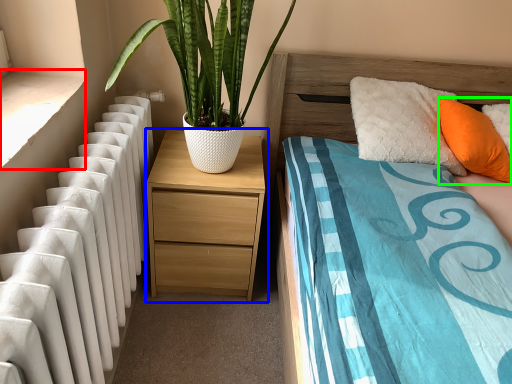
Question: Which is nearer to the window sill (highlighted by a red box)? nightstand (highlighted by a blue box) or pillow (highlighted by a green box).

Choices:
 (A) nightstand
 (B) pillow

Answer: (A)